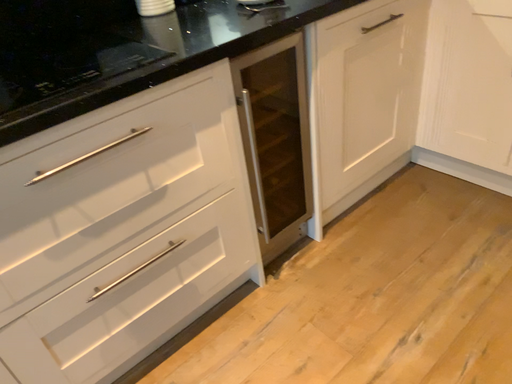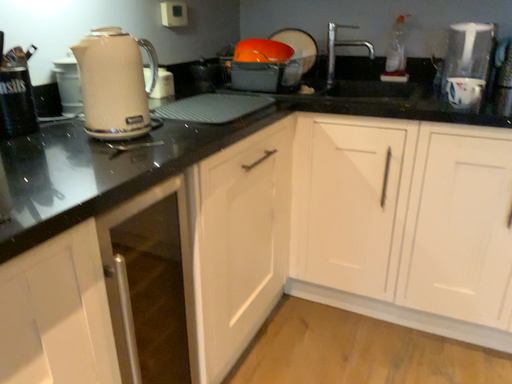
Question: How did the camera likely rotate when shooting the video?

Choices:
 (A) rotated upward
 (B) rotated downward

Answer: (A)